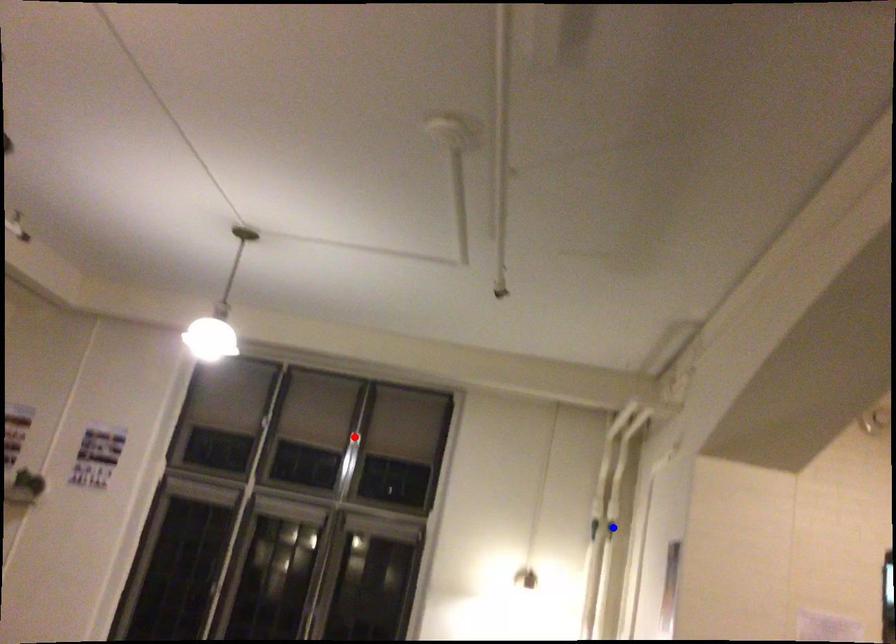
Question: In the image, two points are highlighted. Which point is nearer to the camera? Reply with the corresponding letter.

Choices:
 (A) blue point
 (B) red point

Answer: (A)